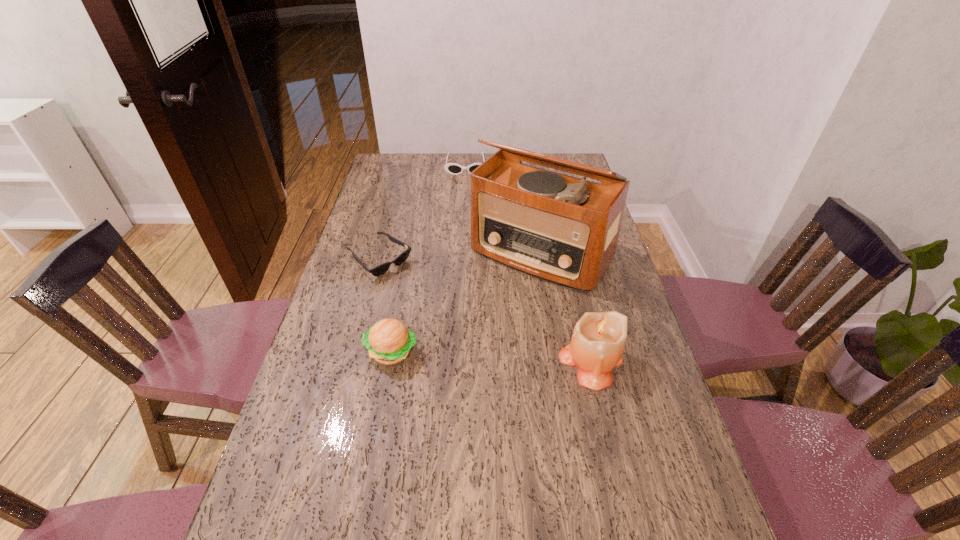
The height and width of the screenshot is (540, 960). Find the location of `vacant region that satisfies the following two spatial constraints: 1. on the back side of the tallest object; 2. on the left side of the third tallest object`. vacant region that satisfies the following two spatial constraints: 1. on the back side of the tallest object; 2. on the left side of the third tallest object is located at coordinates (410, 253).

This screenshot has height=540, width=960. In order to click on vacant space that satisfies the following two spatial constraints: 1. on the front side of the right sunglasses; 2. on the right side of the second tallest object in this screenshot , I will do `click(456, 361)`.